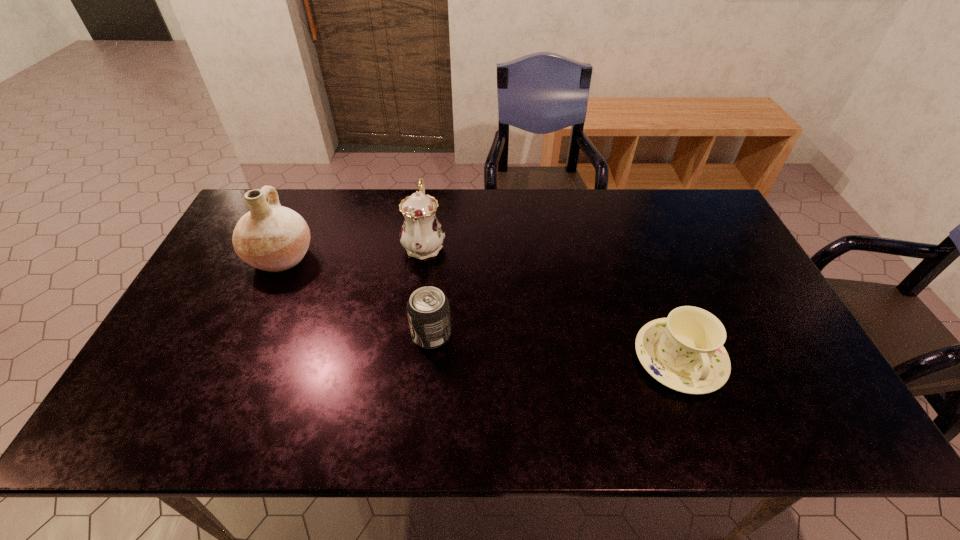
This screenshot has width=960, height=540. I want to click on the leftmost object, so click(x=270, y=237).

The image size is (960, 540). I want to click on the taller chinaware, so click(422, 235).

The height and width of the screenshot is (540, 960). Identify the location of the left chinaware. (422, 235).

I want to click on soda can, so click(428, 310).

Where is `the rightmost object`? the rightmost object is located at coordinates (685, 352).

Image resolution: width=960 pixels, height=540 pixels. What are the coordinates of `the nearer chinaware` in the screenshot? It's located at (685, 352).

What are the coordinates of `blank area located 0.090m to pour from the handle of the pottery` in the screenshot? It's located at (345, 257).

Identify the location of blank space located 0.230m on the front of the taller chinaware. (413, 331).

The height and width of the screenshot is (540, 960). In order to click on vacant space located 0.250m on the back of the soda can in this screenshot , I will do coord(439,255).

This screenshot has height=540, width=960. Find the location of `object that is at the far edge`. object that is at the far edge is located at coordinates (422, 235).